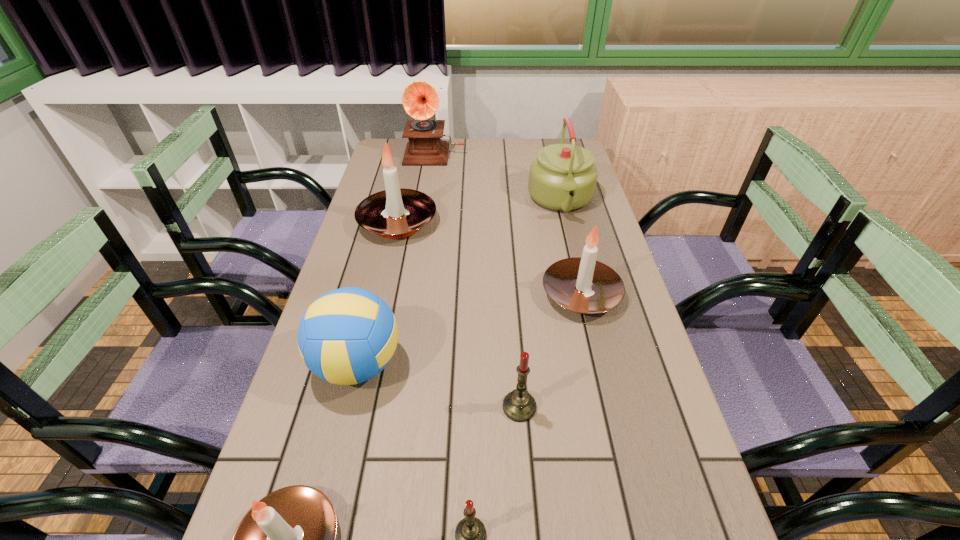
Locate an element on the screen. phonograph record is located at coordinates (420, 100).

Locate an element on the screen. the farthest candle is located at coordinates (396, 212).

The image size is (960, 540). In order to click on the farthest white candle in this screenshot , I will do `click(396, 212)`.

Where is `kettle`? The width and height of the screenshot is (960, 540). kettle is located at coordinates (563, 177).

This screenshot has height=540, width=960. I want to click on the fourth nearest candle, so click(x=583, y=285).

In order to click on the fourth farthest object in this screenshot , I will do `click(583, 285)`.

I want to click on blue volleyball, so click(347, 336).

You are a GUI agent. You are given a task and a screenshot of the screen. Output one action in this format:
    pyautogui.click(x=<x>, y=<y>)
    Task: Click on the third object from right to left
    The image size is (960, 540).
    Given the screenshot: What is the action you would take?
    pyautogui.click(x=519, y=405)

The image size is (960, 540). What are the coordinates of `the third farthest candle` in the screenshot? It's located at (519, 405).

Identify the location of blank space located 0.320m on the horn of the farthest object. (425, 215).